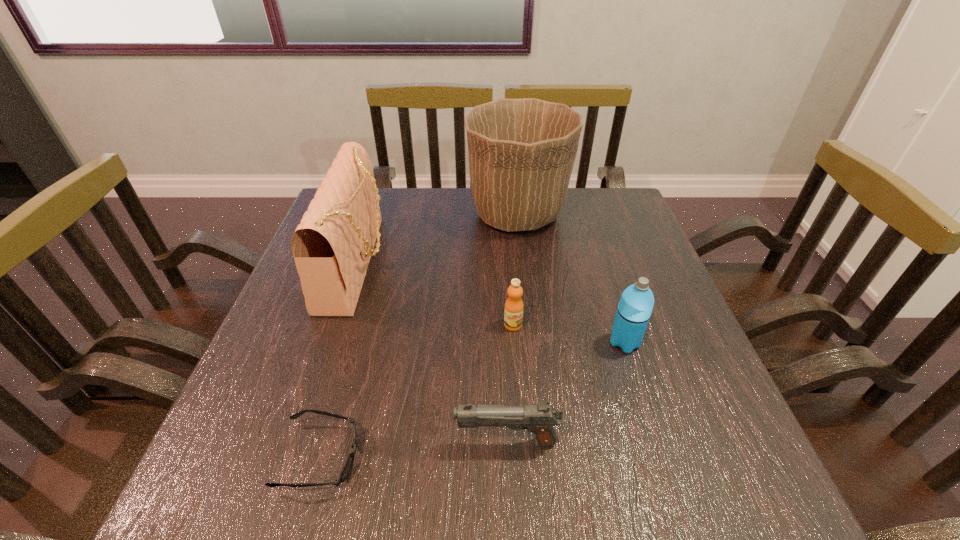
Where is `flowerpot`? flowerpot is located at coordinates (521, 152).

This screenshot has width=960, height=540. I want to click on the second tallest object, so click(x=332, y=246).

Locate an element on the screen. The image size is (960, 540). the rightmost object is located at coordinates (635, 307).

Locate an element on the screen. thermos bottle is located at coordinates (635, 307).

Identify the location of orange juice. The image size is (960, 540). (513, 314).

The width and height of the screenshot is (960, 540). I want to click on gun, so click(540, 419).

Find the location of `the shortest object`. the shortest object is located at coordinates (348, 465).

Find the location of a particular element. vacant space located 0.240m on the front of the tallest object is located at coordinates (528, 309).

The height and width of the screenshot is (540, 960). Find the location of `free space located 0.300m on the front-facing side of the fifth shortest object`. free space located 0.300m on the front-facing side of the fifth shortest object is located at coordinates (505, 263).

This screenshot has width=960, height=540. Find the location of `vacant space situated 0.160m on the back of the rightmost object`. vacant space situated 0.160m on the back of the rightmost object is located at coordinates (605, 281).